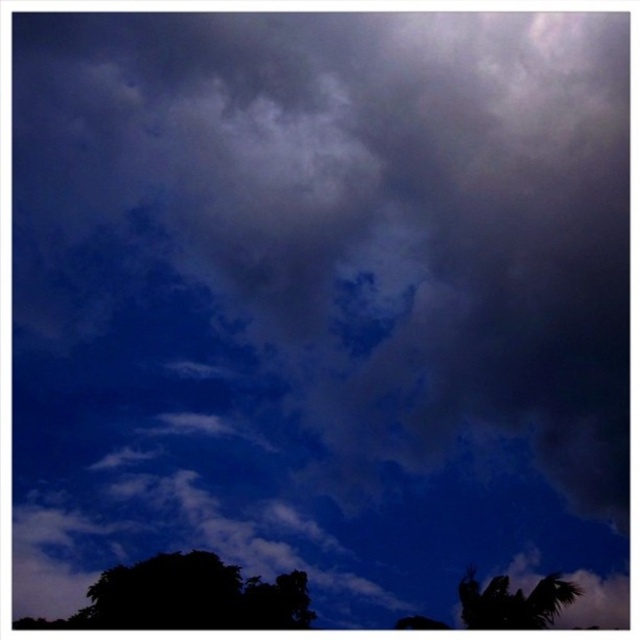
Which is above, silhouette leafy tree at lower left or silhouette leafy palm at bottom right?

silhouette leafy palm at bottom right is higher up.

Identify the location of silhouette leafy tree at lower left. The image size is (640, 640). tap(193, 596).